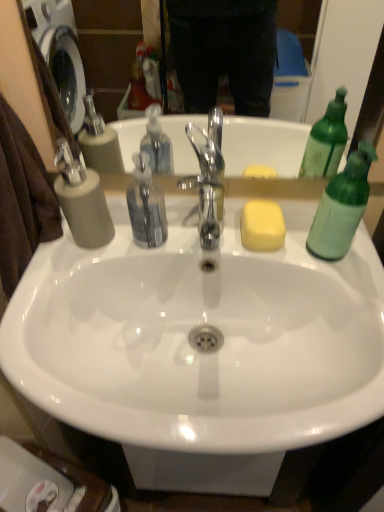
Locate an element on the screen. This screenshot has height=512, width=384. free region on the left part of yellow matte soap at center is located at coordinates (181, 234).